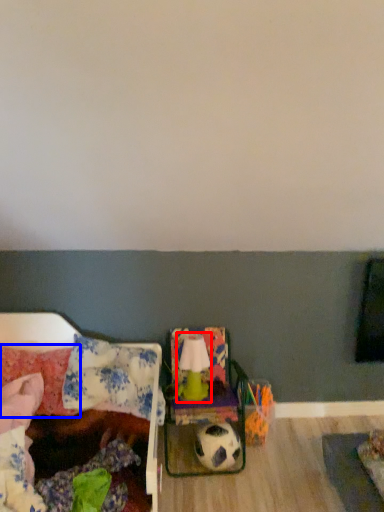
Question: Which object appears closest to the camera in this image, lamp (highlighted by a red box) or pillow (highlighted by a blue box)?

Choices:
 (A) lamp
 (B) pillow

Answer: (B)